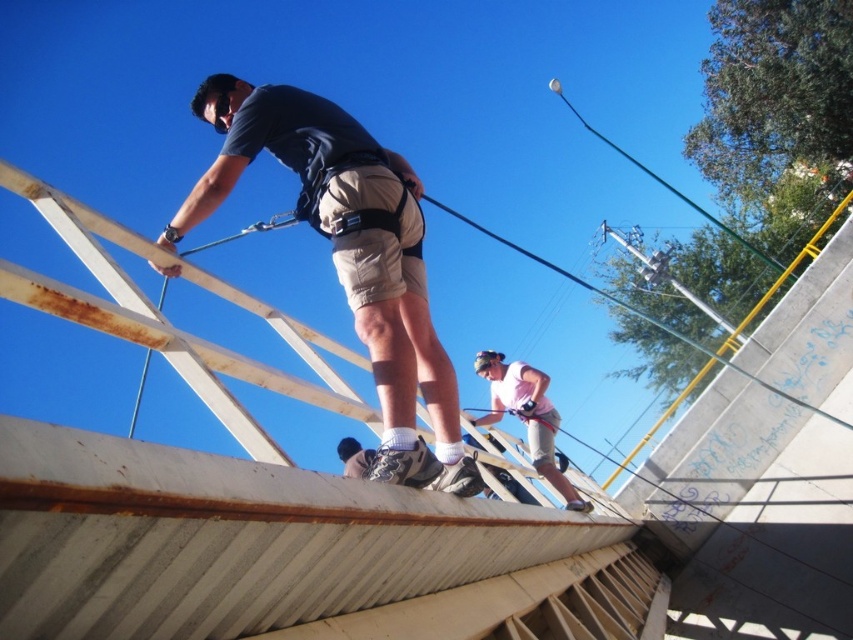
Does matte khaki shorts at center appear on the right side of pink fabric skateboarder at lower center?

No, matte khaki shorts at center is not to the right of pink fabric skateboarder at lower center.

Is matte khaki shorts at center thinner than pink fabric skateboarder at lower center?

Incorrect, matte khaki shorts at center's width is not less than pink fabric skateboarder at lower center's.

What do you see at coordinates (349, 253) in the screenshot? I see `matte khaki shorts at center` at bounding box center [349, 253].

The height and width of the screenshot is (640, 853). Identify the location of matte khaki shorts at center. (349, 253).